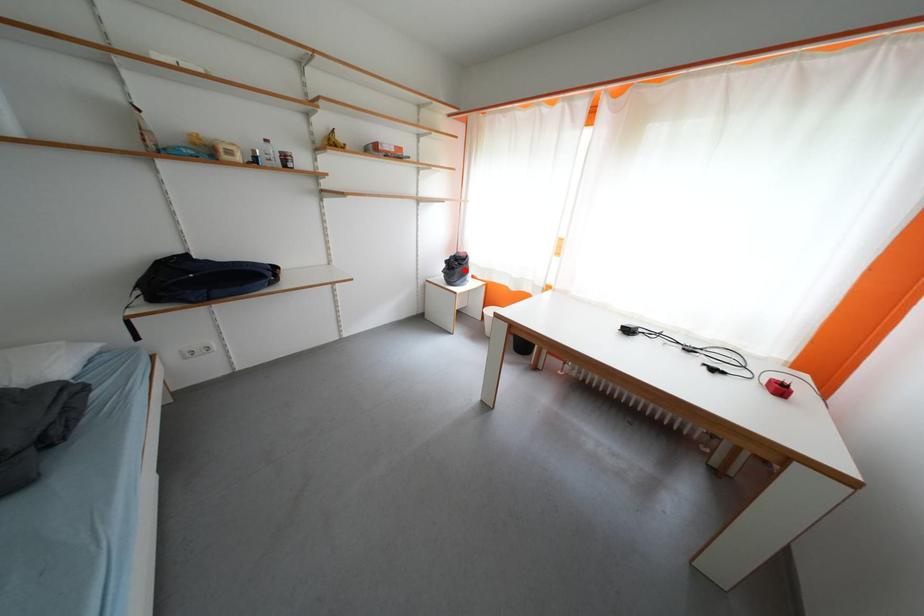
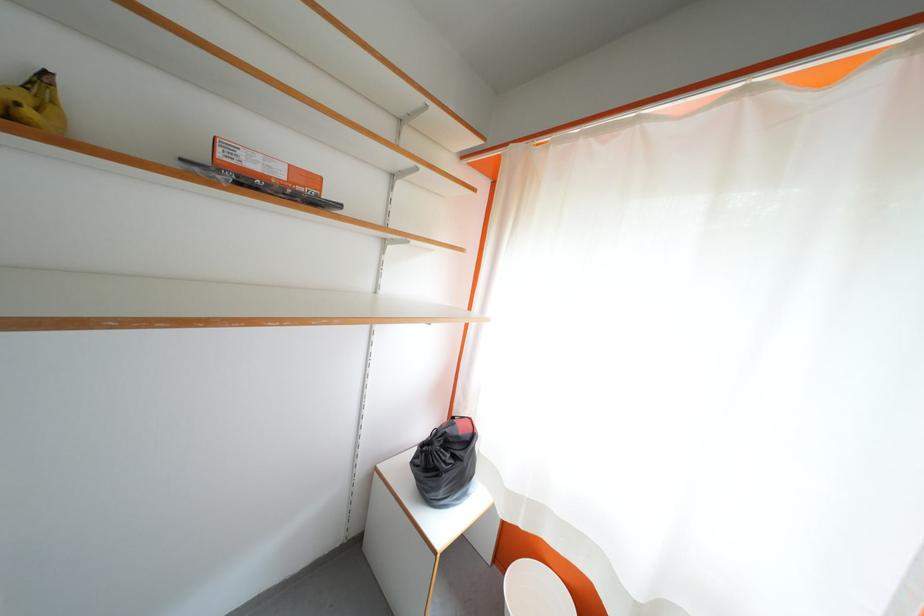
Question: I am providing you with two images of the same scene from different viewpoints. A red point is shown in image1. For the corresponding object point in image2, is it positioned nearer or farther from the camera?

Choices:
 (A) Nearer
 (B) Farther

Answer: (B)